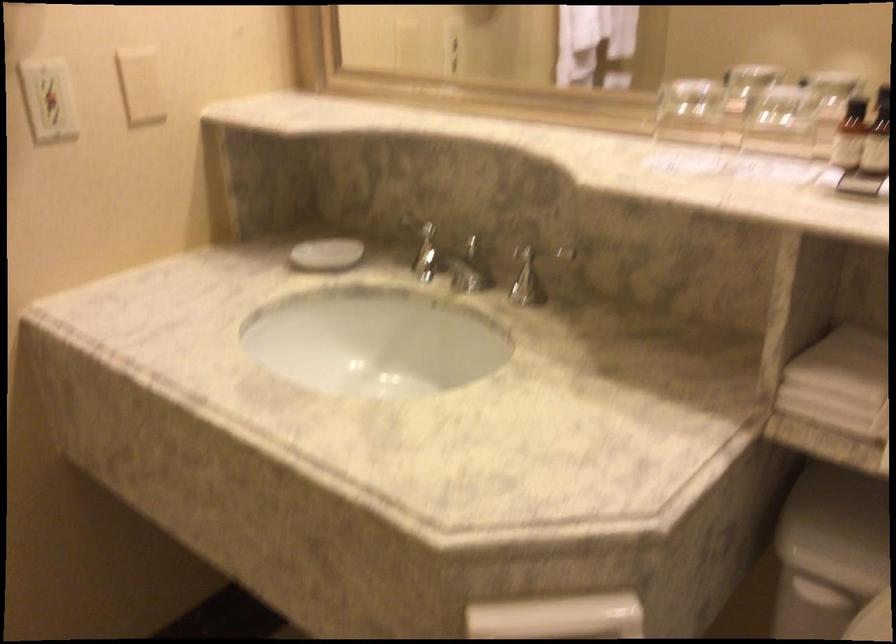
What do you see at coordinates (679, 104) in the screenshot? The image size is (896, 644). I see `the towel roll holder` at bounding box center [679, 104].